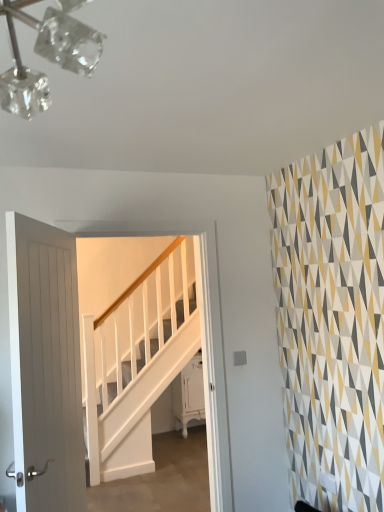
Identify the location of white wooden stairs at center. (134, 401).

What is the approximate width of white wooden stairs at center?

white wooden stairs at center is 2.86 inches wide.

Where is `white glossy cabinet at lower center`? Image resolution: width=384 pixels, height=512 pixels. white glossy cabinet at lower center is located at coordinates (189, 393).

The image size is (384, 512). What are the coordinates of `white wooden stairs at center` in the screenshot? It's located at (134, 401).

Consider the image. Is white glossy cabinet at lower center oriented away from white wooden stairs at center?

No, white glossy cabinet at lower center's orientation is not away from white wooden stairs at center.

Relative to white wooden stairs at center, is white glossy cabinet at lower center in front or behind?

In the image, white glossy cabinet at lower center appears behind white wooden stairs at center.

Which object is thinner, white glossy cabinet at lower center or white wooden stairs at center?

white wooden stairs at center.

From a real-world perspective, relative to white glossy cabinet at lower center, is white wooden stairs at center vertically above or below?

white wooden stairs at center is above white glossy cabinet at lower center.

Which object is thinner, white wooden stairs at center or white glossy cabinet at lower center?

white wooden stairs at center is thinner.

Considering the relative positions of white wooden stairs at center and white glossy cabinet at lower center in the image provided, is white wooden stairs at center behind white glossy cabinet at lower center?

No, it is not.

Can you confirm if white wooden stairs at center is shorter than white glossy cabinet at lower center?

No.

From the image's perspective, between white wooden stairs at center and white wooden door at left, who is located below?

white wooden stairs at center is shown below in the image.

Is point (93, 436) closer or farther from the camera than point (70, 396)?

Point (93, 436).

Is white wooden stairs at center thinner than white wooden door at left?

Correct, the width of white wooden stairs at center is less than that of white wooden door at left.

Is white wooden stairs at center inside the boundaries of white wooden door at left, or outside?

white wooden stairs at center is not inside white wooden door at left, it's outside.

Which of these two, white wooden door at left or white glossy cabinet at lower center, is thinner?

white wooden door at left.

Is there a large distance between white wooden door at left and white glossy cabinet at lower center?

white wooden door at left is positioned a significant distance from white glossy cabinet at lower center.

From the image's perspective, is white wooden door at left positioned above or below white glossy cabinet at lower center?

white wooden door at left is situated higher than white glossy cabinet at lower center in the image.

Is white wooden door at left facing towards white glossy cabinet at lower center?

No, white wooden door at left does not turn towards white glossy cabinet at lower center.

Is point (53, 482) positioned before point (137, 428)?

Yes, it is.

Is white wooden stairs at center located within white wooden door at left?

That's incorrect, white wooden stairs at center is not inside white wooden door at left.

Does white wooden door at left have a greater height compared to white wooden stairs at center?

No.

Is white wooden door at left far away from white wooden stairs at center?

white wooden door at left is positioned a significant distance from white wooden stairs at center.

Locate an element on the screen. The width and height of the screenshot is (384, 512). furniture on the right of white wooden door at left is located at coordinates (189, 393).

Which of these two, white glossy cabinet at lower center or white wooden door at left, is smaller?

white glossy cabinet at lower center.

Are white glossy cabinet at lower center and white wooden door at left beside each other?

white glossy cabinet at lower center and white wooden door at left are clearly separated.

Considering the relative sizes of white glossy cabinet at lower center and white wooden door at left in the image provided, is white glossy cabinet at lower center wider than white wooden door at left?

Correct, the width of white glossy cabinet at lower center exceeds that of white wooden door at left.

I want to click on furniture behind the white wooden stairs at center, so click(x=189, y=393).

You are a GUI agent. You are given a task and a screenshot of the screen. Output one action in this format:
    pyautogui.click(x=<x>, y=<y>)
    Task: Click on the stairs above the white glossy cabinet at lower center (from a real-world perspective)
    This screenshot has width=384, height=512.
    Given the screenshot: What is the action you would take?
    pyautogui.click(x=134, y=401)

Which object lies further to the anchor point white wooden door at left, white wooden stairs at center or white glossy cabinet at lower center?

white glossy cabinet at lower center lies further to white wooden door at left than the other object.

Considering their positions, is white wooden door at left positioned closer to white glossy cabinet at lower center than white wooden stairs at center?

white wooden stairs at center is positioned closer to the anchor white glossy cabinet at lower center.

Looking at the image, which one is located further to white wooden stairs at center, white glossy cabinet at lower center or white wooden door at left?

white wooden door at left lies further to white wooden stairs at center than the other object.

From the image, which object appears to be farther from white wooden stairs at center, white wooden door at left or white glossy cabinet at lower center?

Based on the image, white wooden door at left appears to be further to white wooden stairs at center.

When comparing their distances from white wooden door at left, does white glossy cabinet at lower center or white wooden stairs at center seem further?

Based on the image, white glossy cabinet at lower center appears to be further to white wooden door at left.

When comparing their distances from white glossy cabinet at lower center, does white wooden stairs at center or white wooden door at left seem further?

white wooden door at left is positioned further to the anchor white glossy cabinet at lower center.

The width and height of the screenshot is (384, 512). I want to click on stairs between white wooden door at left and white glossy cabinet at lower center from front to back, so click(134, 401).